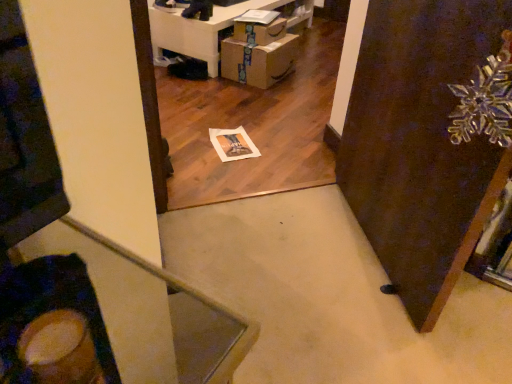
Identify the location of vacant region in front of cardboard boxes at lower center. (250, 101).